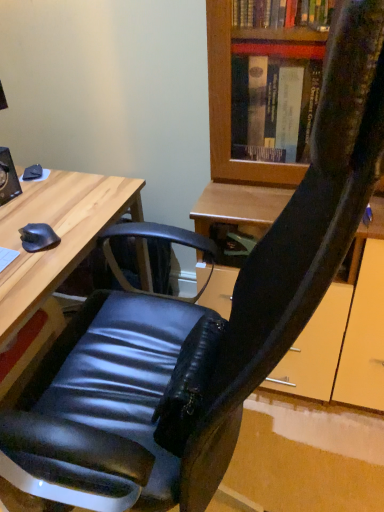
Question: Is there a large distance between wooden desk at left and matte black mouse at left?

Choices:
 (A) yes
 (B) no

Answer: (B)

Question: Does wooden desk at left have a greater width compared to matte black mouse at left?

Choices:
 (A) yes
 (B) no

Answer: (A)

Question: From a real-world perspective, is wooden desk at left over matte black mouse at left?

Choices:
 (A) yes
 (B) no

Answer: (B)

Question: Considering the relative sizes of wooden desk at left and matte black mouse at left in the image provided, is wooden desk at left bigger than matte black mouse at left?

Choices:
 (A) yes
 (B) no

Answer: (A)

Question: Could you tell me if wooden desk at left is turned towards matte black mouse at left?

Choices:
 (A) yes
 (B) no

Answer: (B)

Question: Is wooden desk at left further to camera compared to matte black mouse at left?

Choices:
 (A) yes
 (B) no

Answer: (B)

Question: Is matte black mouse at left completely or partially outside of wooden desk at left?

Choices:
 (A) no
 (B) yes

Answer: (B)

Question: Is wooden desk at left a part of matte black mouse at left?

Choices:
 (A) yes
 (B) no

Answer: (B)

Question: Does matte black mouse at left come in front of wooden desk at left?

Choices:
 (A) yes
 (B) no

Answer: (B)

Question: Is matte black mouse at left positioned behind wooden desk at left?

Choices:
 (A) no
 (B) yes

Answer: (B)

Question: Can you confirm if matte black mouse at left is positioned to the right of wooden desk at left?

Choices:
 (A) no
 (B) yes

Answer: (B)

Question: Can you confirm if matte black mouse at left is positioned to the left of wooden desk at left?

Choices:
 (A) no
 (B) yes

Answer: (A)

Question: Considering the positions of matte black mouse at left and wooden desk at left in the image, is matte black mouse at left taller or shorter than wooden desk at left?

Choices:
 (A) tall
 (B) short

Answer: (B)